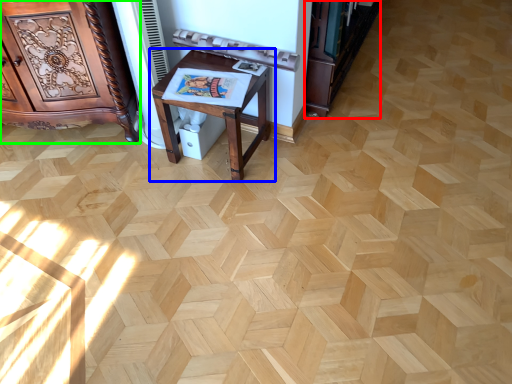
Question: Estimate the real-world distances between objects in this image. Which object is farther from bookshelf (highlighted by a red box), table (highlighted by a blue box) or furniture (highlighted by a green box)?

Choices:
 (A) table
 (B) furniture

Answer: (B)